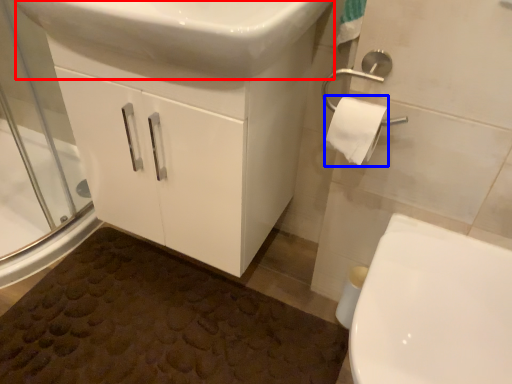
Question: Which of the following is the farthest to the observer, sink (highlighted by a red box) or toilet paper (highlighted by a blue box)?

Choices:
 (A) sink
 (B) toilet paper

Answer: (B)